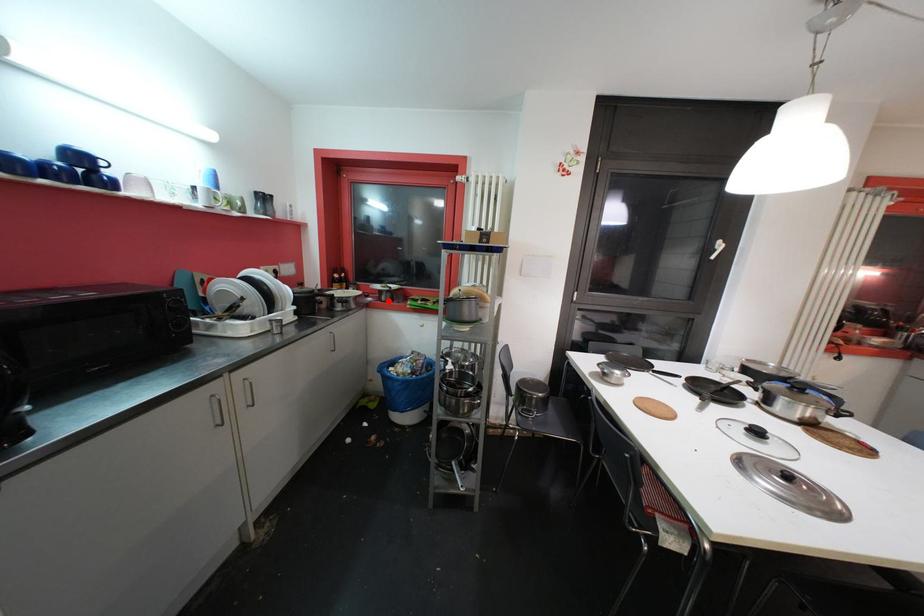
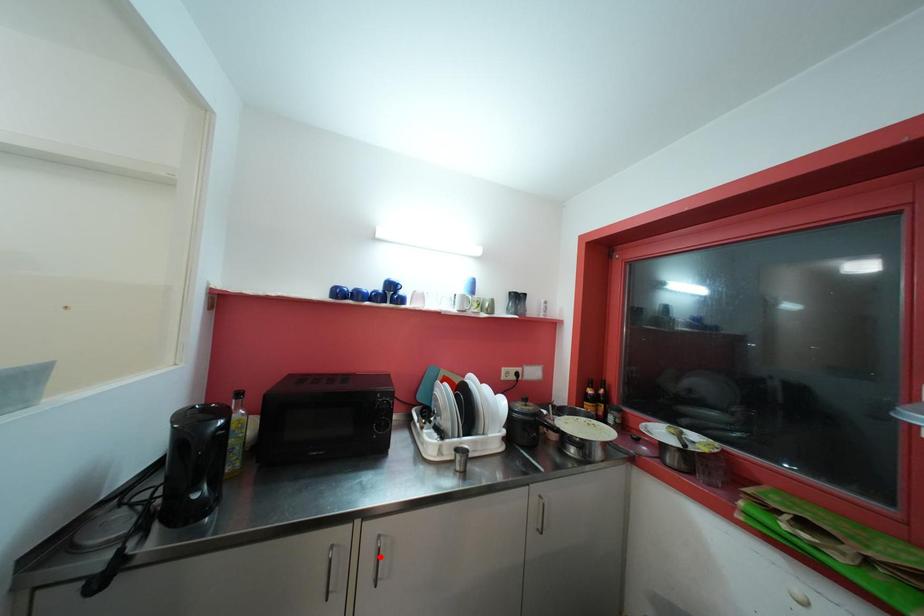
I am providing you with two images of the same scene from different viewpoints. A red point is marked on the first image and another point is marked on the second image. Do the highlighted points in image1 and image2 indicate the same real-world spot?

No